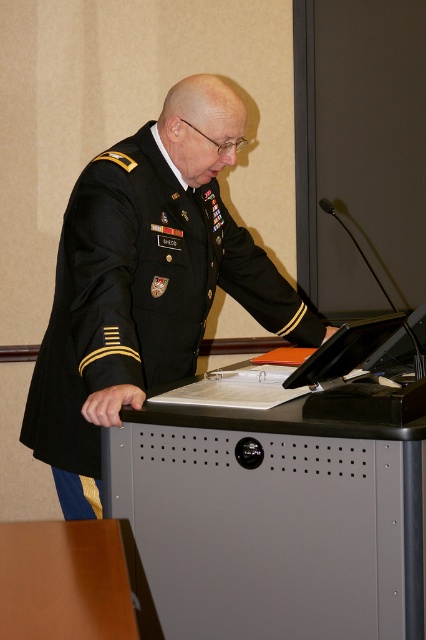
Is metallic gray table at center bigger than black matte military uniform at center?

Actually, metallic gray table at center might be smaller than black matte military uniform at center.

Is metallic gray table at center positioned behind black matte military uniform at center?

That is False.

Does point (157, 435) come farther from viewer compared to point (169, 193)?

No.

Image resolution: width=426 pixels, height=640 pixels. Identify the location of metallic gray table at center. (273, 516).